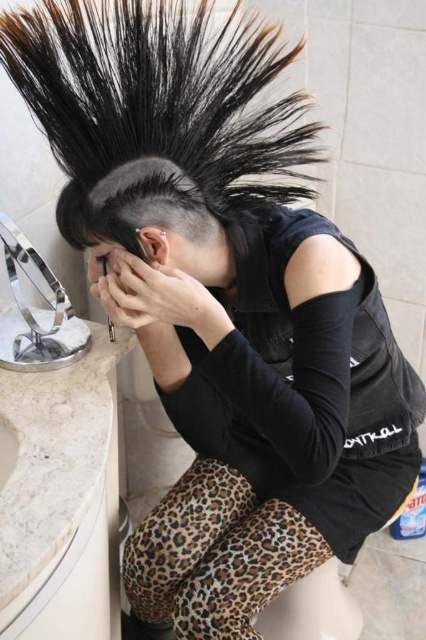
You are a photographer taking a closeup shot of the person in the bathroom. You have two points marked on your viewfinder at coordinates point [195,579] and point [108,298]. Which point is closer to the camera?

Point [108,298] is closer to the camera because it is behind point [195,579], which is closer to the camera.

You are standing in the bathroom and want to reach both the point at coordinates point [189,544] and point [201,204]. Which point should you move towards first to reach the closer one?

You should move towards point [201,204] first because it is closer to you than point [189,544], which is further away.